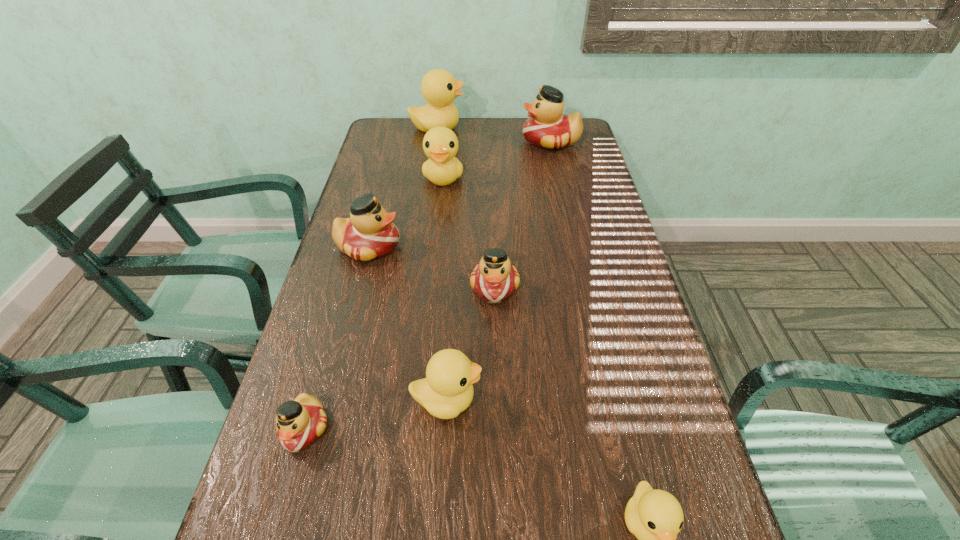
You are a GUI agent. You are given a task and a screenshot of the screen. Output one action in this format:
    pyautogui.click(x=<x>, y=<y>)
    Task: Click on the nearest red duck
    Image resolution: width=960 pixels, height=540 pixels.
    Given the screenshot: What is the action you would take?
    pyautogui.click(x=299, y=422)

What are the coordinates of `free location located on the face of the biggest yellow duck` in the screenshot? It's located at (537, 128).

Identify the location of blank area located on the face of the biggest red duck. The width and height of the screenshot is (960, 540). (428, 141).

In order to click on blank area located on the face of the biggest red duck in this screenshot , I will do point(464,141).

You are a GUI agent. You are given a task and a screenshot of the screen. Output one action in this format:
    pyautogui.click(x=<x>, y=<y>)
    Task: Click on the free spot located 0.160m on the face of the biggest red duck
    
    Given the screenshot: What is the action you would take?
    pyautogui.click(x=477, y=141)

I want to click on free space located on the face of the third nearest yellow duck, so click(x=435, y=257).

Where is `vacant position located 0.320m on the face of the second farthest red duck`? Image resolution: width=960 pixels, height=540 pixels. vacant position located 0.320m on the face of the second farthest red duck is located at coordinates (517, 246).

In order to click on vacant region located on the face of the third farthest yellow duck in this screenshot , I will do `click(600, 400)`.

Locate an element on the screen. vacant space situated on the face of the fifth farthest duck is located at coordinates (501, 475).

The height and width of the screenshot is (540, 960). In order to click on free space located on the face of the smallest red duck in this screenshot , I will do `click(277, 522)`.